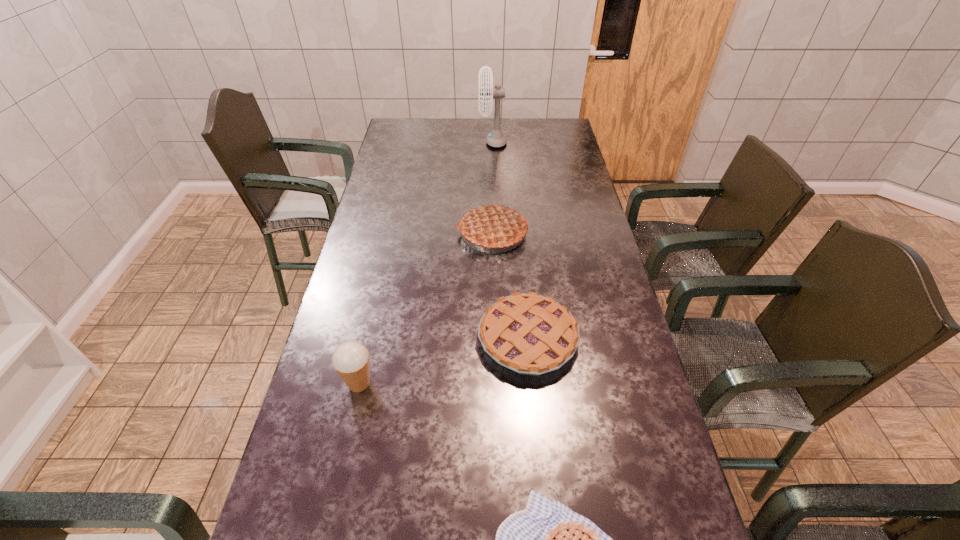
The width and height of the screenshot is (960, 540). In order to click on the farthest object in this screenshot , I will do `click(496, 138)`.

Find the location of a particular element. This screenshot has width=960, height=540. fan is located at coordinates (496, 138).

What are the coordinates of `the farthest pie` in the screenshot? It's located at (493, 226).

Where is `the fourth shortest object`? the fourth shortest object is located at coordinates (493, 226).

What are the coordinates of `the leftmost object` in the screenshot? It's located at (350, 359).

The height and width of the screenshot is (540, 960). What are the coordinates of `the third tallest object` in the screenshot? It's located at (350, 359).

The height and width of the screenshot is (540, 960). I want to click on the second tallest pie, so click(530, 334).

Locate an element on the screen. the second shortest object is located at coordinates (530, 334).

The height and width of the screenshot is (540, 960). What are the coordinates of `vacant area situated 0.300m on the front-facing side of the tallest object` in the screenshot? It's located at (413, 142).

At what (x,y) coordinates should I click in order to perform the action: click on free spot located 0.150m on the front-facing side of the tallest object. Please return your answer as a coordinate pair (x, y). Looking at the image, I should click on (445, 142).